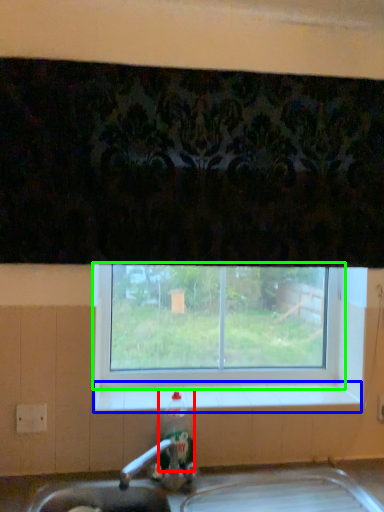
Question: Which is farther away from bottle (highlighted by a red box)? window sill (highlighted by a blue box) or window (highlighted by a green box)?

Choices:
 (A) window sill
 (B) window

Answer: (B)